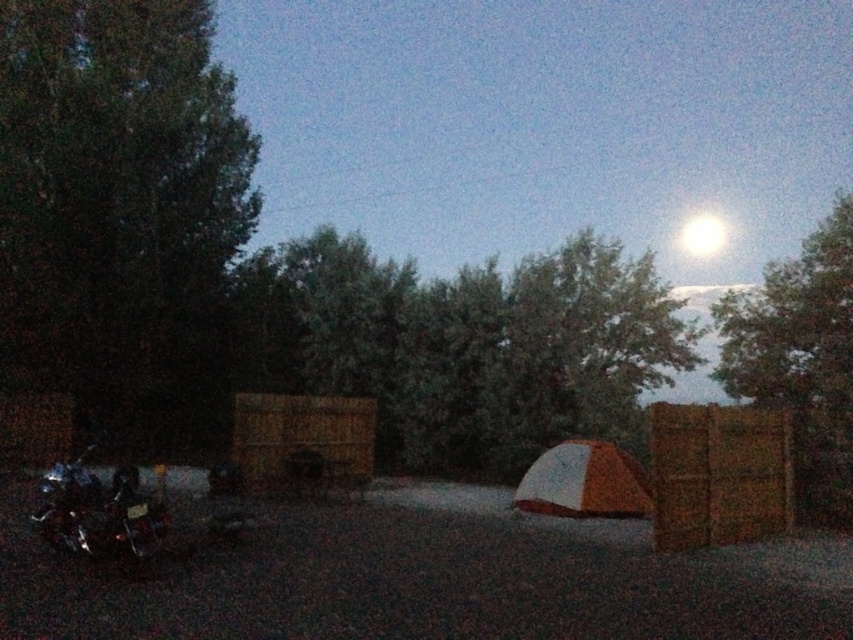
You are standing at the point marked by the coordinate point at point (801, 358) and want to walk towards the motorcycle parked on the left side. Which direction should you head?

The point at (801, 358) is located at the green leafy tree at upper right. To reach the motorcycle parked on the left side, you should head towards the left direction.

You are standing at the point where the motorcycle is parked on the left side of the gravelly area. You want to walk to the point marked at coordinates point (692, 442). How far will you have to walk?

The distance of point (692, 442) from viewer is 12.32 meters, so you will have to walk 12.32 meters to reach it.

You are planning to take a photo of the green leafy tree at center and the green leafy tree at upper right. Which tree should you focus on if you want to capture a wider view of the foliage in a single shot?

The green leafy tree at upper right has a greater width than the green leafy tree at center, so focusing on it would allow you to capture a wider view of the foliage in a single shot.